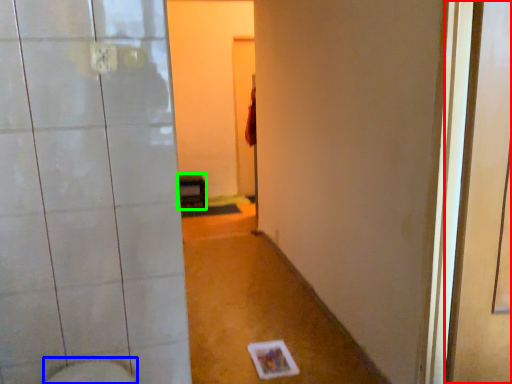
Question: Which is farther away from screen door (highlighted by a red box)? bidet (highlighted by a blue box) or furniture (highlighted by a green box)?

Choices:
 (A) bidet
 (B) furniture

Answer: (B)